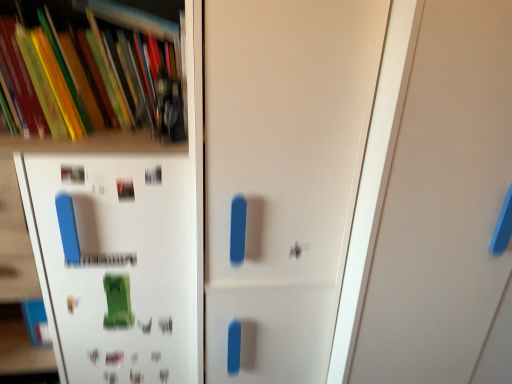
Question: Is matte white door at center, the 2th door from the right, surrounded by matte plastic books at upper left?

Choices:
 (A) no
 (B) yes

Answer: (A)

Question: Considering the relative sizes of matte plastic books at upper left and matte white door at center, the 2th door from the right, in the image provided, is matte plastic books at upper left wider than matte white door at center, the 2th door from the right,?

Choices:
 (A) yes
 (B) no

Answer: (B)

Question: From a real-world perspective, is matte plastic books at upper left under matte white door at center, the 2th door from the right?

Choices:
 (A) no
 (B) yes

Answer: (A)

Question: Is the position of matte plastic books at upper left less distant than that of matte white door at center, the 2th door from the right?

Choices:
 (A) no
 (B) yes

Answer: (A)

Question: Considering the relative sizes of matte plastic books at upper left and matte white door at center, the 2th door from the right, in the image provided, is matte plastic books at upper left shorter than matte white door at center, the 2th door from the right,?

Choices:
 (A) yes
 (B) no

Answer: (A)

Question: Is matte plastic books at upper left in front of or behind white matte shelf at upper left in the image?

Choices:
 (A) front
 (B) behind

Answer: (B)

Question: From the image's perspective, is matte plastic books at upper left above or below white matte shelf at upper left?

Choices:
 (A) above
 (B) below

Answer: (A)

Question: Is matte plastic books at upper left spatially inside white matte shelf at upper left, or outside of it?

Choices:
 (A) outside
 (B) inside

Answer: (B)

Question: Considering the relative positions of matte plastic books at upper left and white matte shelf at upper left in the image provided, is matte plastic books at upper left to the left or to the right of white matte shelf at upper left?

Choices:
 (A) right
 (B) left

Answer: (A)

Question: Considering the positions of white matte shelf at upper left and matte white door at center, marked as the 1th door in a left-to-right arrangement, in the image, is white matte shelf at upper left bigger or smaller than matte white door at center, marked as the 1th door in a left-to-right arrangement,?

Choices:
 (A) small
 (B) big

Answer: (B)

Question: Would you say white matte shelf at upper left is to the left or to the right of matte white door at center, the 2th door from the right, in the picture?

Choices:
 (A) left
 (B) right

Answer: (A)

Question: Looking at their shapes, would you say white matte shelf at upper left is wider or thinner than matte white door at center, the 2th door from the right?

Choices:
 (A) wide
 (B) thin

Answer: (A)

Question: Considering the positions of white matte shelf at upper left and matte white door at center, the 2th door from the right, in the image, is white matte shelf at upper left taller or shorter than matte white door at center, the 2th door from the right,?

Choices:
 (A) tall
 (B) short

Answer: (B)

Question: Considering the positions of matte plastic books at upper left and white matte door at center, acting as the second door starting from the left, in the image, is matte plastic books at upper left bigger or smaller than white matte door at center, acting as the second door starting from the left,?

Choices:
 (A) small
 (B) big

Answer: (A)

Question: In terms of width, does matte plastic books at upper left look wider or thinner when compared to white matte door at center, acting as the second door starting from the left?

Choices:
 (A) thin
 (B) wide

Answer: (A)